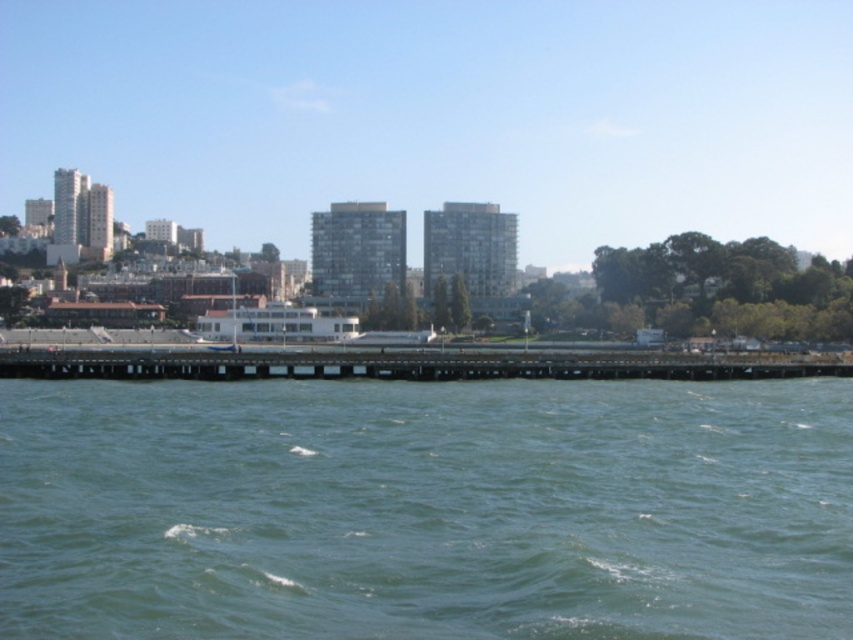
Question: Can you confirm if green water at center is positioned to the right of wooden pier at center?

Choices:
 (A) yes
 (B) no

Answer: (A)

Question: Which object appears farthest from the camera in this image?

Choices:
 (A) wooden pier at center
 (B) green water at center

Answer: (A)

Question: Does green water at center come in front of wooden pier at center?

Choices:
 (A) no
 (B) yes

Answer: (B)

Question: Considering the relative positions of green water at center and wooden pier at center in the image provided, where is green water at center located with respect to wooden pier at center?

Choices:
 (A) above
 (B) below

Answer: (B)